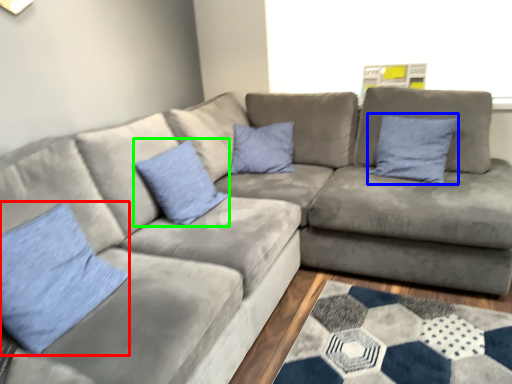
Question: Which is farther away from pillow (highlighted by a red box)? pillow (highlighted by a blue box) or pillow (highlighted by a green box)?

Choices:
 (A) pillow
 (B) pillow

Answer: (A)